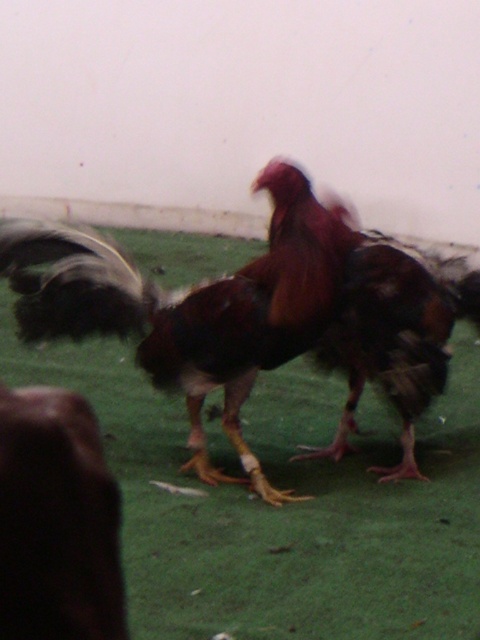
You are a photographer trying to capture the two roosters in the scene. You want to ensure that both roosters are fully visible in your photo. Given their positions at point (288, 566) and point (274, 248), which rooster should you focus on first to make sure the one closer to the camera is in focus?

Point (288, 566) is in front of point (274, 248), so you should focus on the rooster at point (288, 566) first to ensure it is in focus since it is closer to the camera.

You are a photographer setting up a shoot with the two roosters. You want to ensure that the green artificial turf at center is visible behind the brown feathered rooster at center. Based on their positions, is this possible?

The green artificial turf at center is located below the brown feathered rooster at center, so it will not be visible behind the rooster since it is positioned underneath.